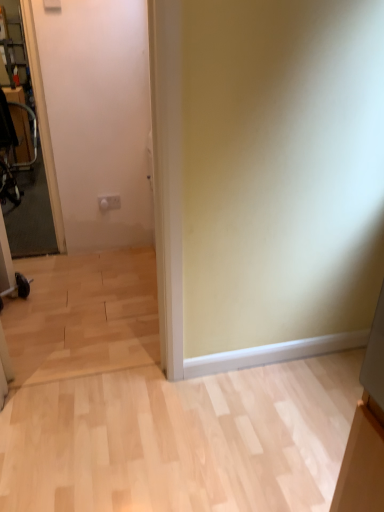
Question: Could you tell me if metallic silver swivel chair at left is turned towards transparent glass door at left?

Choices:
 (A) no
 (B) yes

Answer: (A)

Question: Considering the relative positions of metallic silver swivel chair at left and transparent glass door at left in the image provided, is metallic silver swivel chair at left in front of transparent glass door at left?

Choices:
 (A) no
 (B) yes

Answer: (A)

Question: Can you confirm if metallic silver swivel chair at left is smaller than transparent glass door at left?

Choices:
 (A) no
 (B) yes

Answer: (A)

Question: From a real-world perspective, is metallic silver swivel chair at left under transparent glass door at left?

Choices:
 (A) no
 (B) yes

Answer: (B)

Question: Is metallic silver swivel chair at left wider than transparent glass door at left?

Choices:
 (A) no
 (B) yes

Answer: (B)

Question: Is metallic silver swivel chair at left not near transparent glass door at left?

Choices:
 (A) yes
 (B) no

Answer: (B)

Question: Is transparent glass door at left looking in the opposite direction of metallic silver swivel chair at left?

Choices:
 (A) no
 (B) yes

Answer: (B)

Question: Is transparent glass door at left outside of metallic silver swivel chair at left?

Choices:
 (A) no
 (B) yes

Answer: (B)

Question: Is transparent glass door at left closer to the viewer compared to metallic silver swivel chair at left?

Choices:
 (A) no
 (B) yes

Answer: (B)

Question: Is transparent glass door at left shorter than metallic silver swivel chair at left?

Choices:
 (A) no
 (B) yes

Answer: (A)

Question: Would you consider transparent glass door at left to be distant from metallic silver swivel chair at left?

Choices:
 (A) yes
 (B) no

Answer: (B)

Question: Does transparent glass door at left turn towards metallic silver swivel chair at left?

Choices:
 (A) yes
 (B) no

Answer: (B)

Question: From a real-world perspective, is transparent glass door at left positioned above or below metallic silver swivel chair at left?

Choices:
 (A) below
 (B) above

Answer: (B)